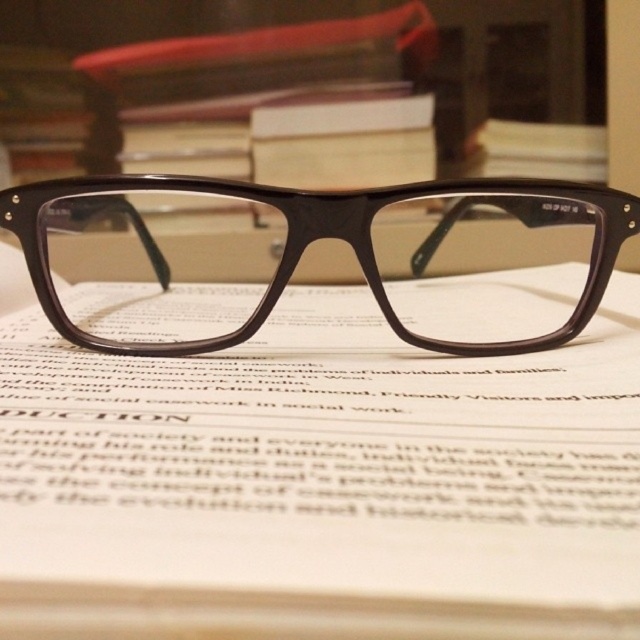
Question: Among these objects, which one is farthest from the camera?

Choices:
 (A) matte brown book at center
 (B) matte brown frame at center

Answer: (B)

Question: Which of the following is the closest to the observer?

Choices:
 (A) (404, 304)
 (B) (282, 328)

Answer: (B)

Question: Can you confirm if matte brown book at center is smaller than matte brown frame at center?

Choices:
 (A) yes
 (B) no

Answer: (A)

Question: Does matte brown book at center have a lesser width compared to matte brown frame at center?

Choices:
 (A) no
 (B) yes

Answer: (B)

Question: Does matte brown book at center have a larger size compared to matte brown frame at center?

Choices:
 (A) yes
 (B) no

Answer: (B)

Question: Among these points, which one is farthest from the camera?

Choices:
 (A) (369, 604)
 (B) (150, 289)

Answer: (B)